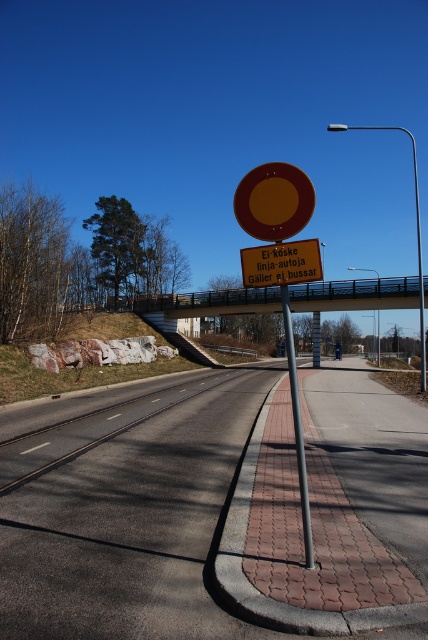
Does metallic gray bridge at center have a lesser height compared to yellow reflective circle at center?

Yes.

Can you confirm if metallic gray bridge at center is taller than yellow reflective circle at center?

No, metallic gray bridge at center is not taller than yellow reflective circle at center.

Which is in front, point (380, 292) or point (308, 214)?

Point (308, 214)

Where is `metallic gray bridge at center`? This screenshot has width=428, height=640. metallic gray bridge at center is located at coordinates coord(356,294).

Between point (392, 536) and point (287, 298), which one is positioned behind?

The point (392, 536) is behind.

Can you confirm if asphalt road at center is positioned below polished metal pole at center?

Yes, asphalt road at center is below polished metal pole at center.

Which is in front, point (35, 468) or point (308, 540)?

Positioned in front is point (308, 540).

You are a GUI agent. You are given a task and a screenshot of the screen. Output one action in this format:
    pyautogui.click(x=<x>, y=<y>)
    Task: Click on the asphalt road at center
    The image size is (428, 640).
    Given the screenshot: What is the action you would take?
    pyautogui.click(x=124, y=508)

Can you confirm if asphalt road at center is shorter than yellow reflective circle at center?

Yes.

Does asphalt road at center appear under yellow reflective circle at center?

Correct, asphalt road at center is located below yellow reflective circle at center.

The width and height of the screenshot is (428, 640). Identify the location of asphalt road at center. (x=124, y=508).

The image size is (428, 640). I want to click on asphalt road at center, so click(x=124, y=508).